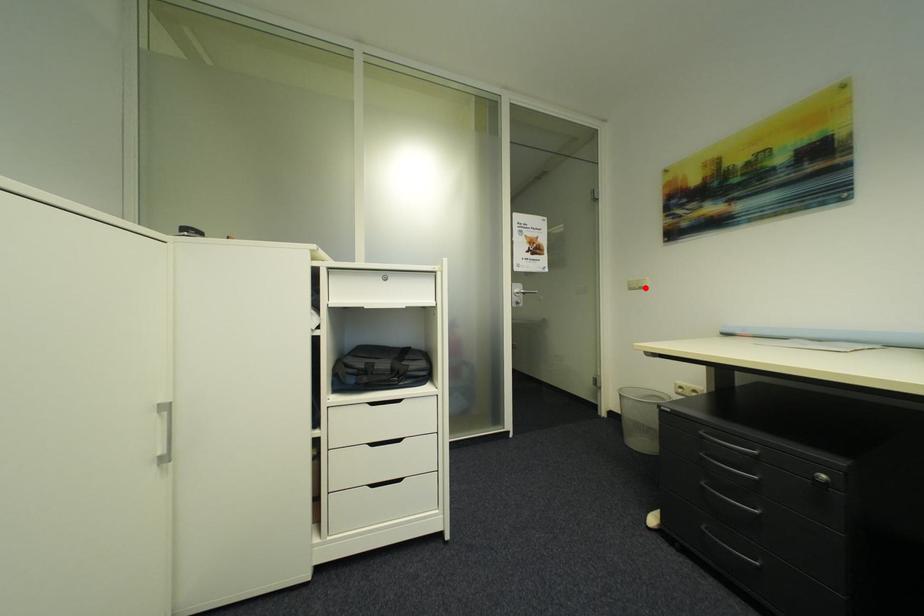
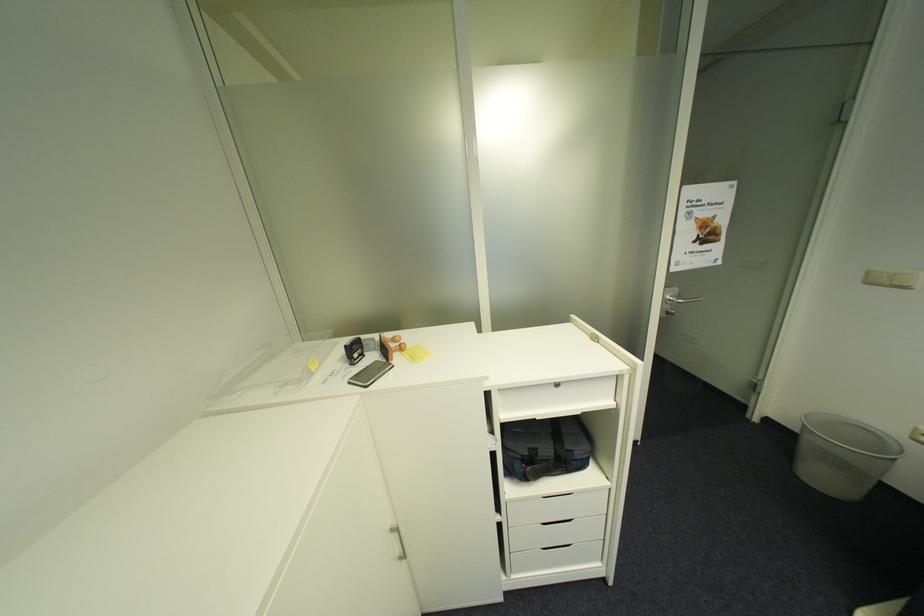
Question: I am providing you with two images of the same scene from different viewpoints. Image1 has a red point marked. In image2, the corresponding 3D location appears at what relative position? Reply with the corresponding letter.

Choices:
 (A) Closer
 (B) Farther

Answer: (B)